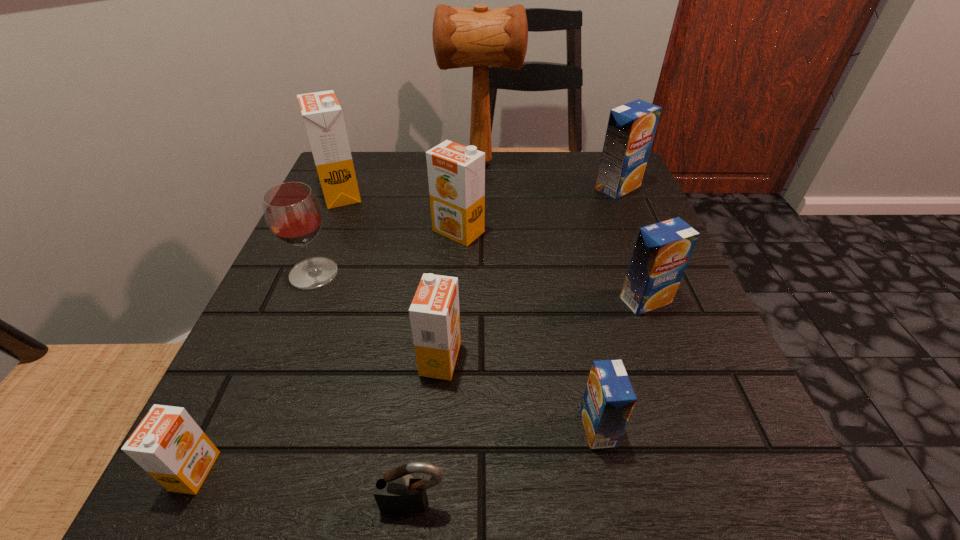
Identify the location of empty location between the third nearest orange orange juice and the farthest blue orange_juice. This screenshot has height=540, width=960. (539, 210).

Find the location of a particular element. Image resolution: width=960 pixels, height=540 pixels. vacant space that's between the fourth nearest orange juice and the seventh farthest object is located at coordinates (543, 329).

Where is `free space between the farthest blue orange_juice and the seventh nearest object`? This screenshot has height=540, width=960. free space between the farthest blue orange_juice and the seventh nearest object is located at coordinates (539, 210).

You are a GUI agent. You are given a task and a screenshot of the screen. Output one action in this format:
    pyautogui.click(x=<x>, y=<y>)
    Task: Click on the unoccupied position between the padlock and the red wineglass
    Image resolution: width=960 pixels, height=540 pixels.
    Given the screenshot: What is the action you would take?
    pyautogui.click(x=364, y=388)

In order to click on vacant space in between the nearest orange orange juice and the fourth nearest object in this screenshot , I will do [x=318, y=415].

Where is `vacant region between the third object from right to left and the mallet`? The width and height of the screenshot is (960, 540). vacant region between the third object from right to left and the mallet is located at coordinates (539, 296).

Identify the location of free spot between the padlock and the farthest orange orange juice. (377, 349).

Where is `free point between the second smallest blue orange_juice and the farthest blue orange_juice`? This screenshot has width=960, height=540. free point between the second smallest blue orange_juice and the farthest blue orange_juice is located at coordinates (632, 244).

Where is `empty location between the third nearest orange orange juice and the second nearest blue orange_juice`? This screenshot has height=540, width=960. empty location between the third nearest orange orange juice and the second nearest blue orange_juice is located at coordinates (552, 266).

Identify which object is located as the second nearest to the ninth shortest object. Please provide its 2D coordinates. Your answer should be formatted as a tuple, i.e. [(x, y)], where the tuple contains the x and y coordinates of a point satisfying the conditions above.

[(480, 38)]